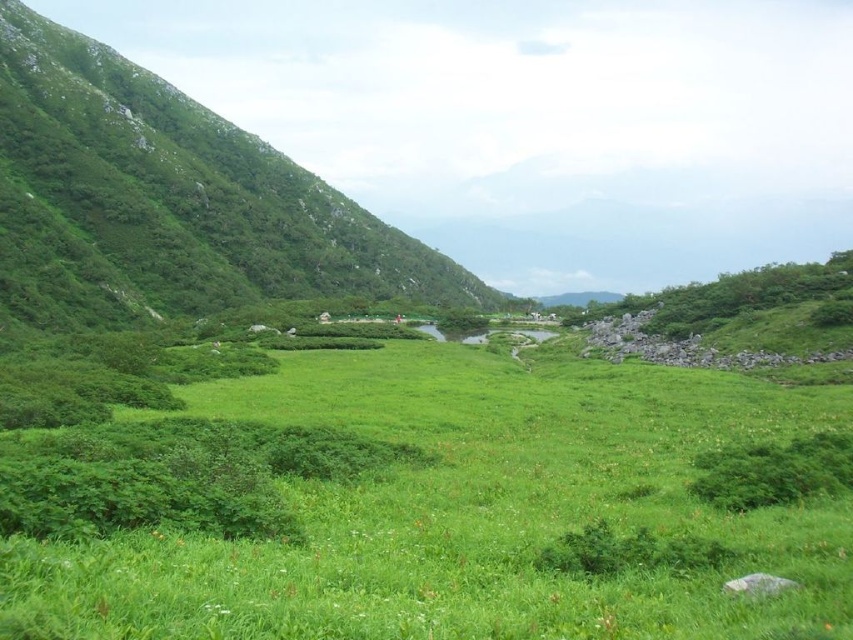
Based on the photo, you are standing in the meadow and want to climb up to the highest point you can see. Which of the two green areas, the green grassy field at center or the green grassy hillside at left, should you head towards?

The green grassy hillside at left is higher than the green grassy field at center, so you should head towards the green grassy hillside at left to reach the highest point.

You are standing in the middle of the green grassy field at center and want to walk to the green grassy hillside at left. Since the field is smaller than the hillside, which direction should you head to reach the hillside?

The green grassy field at center has a smaller size compared to green grassy hillside at left. To reach the hillside, you should head towards the left direction as the hillside is larger and located to your left side.

You are standing at the point marked by coordinates point [422,506] in the image. What type of terrain are you currently standing on?

You are standing on the green grassy field at center.